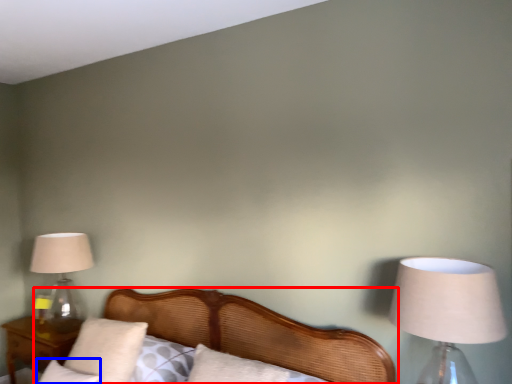
Question: Which object is further to the camera taking this photo, bed (highlighted by a red box) or pillow (highlighted by a blue box)?

Choices:
 (A) bed
 (B) pillow

Answer: (B)